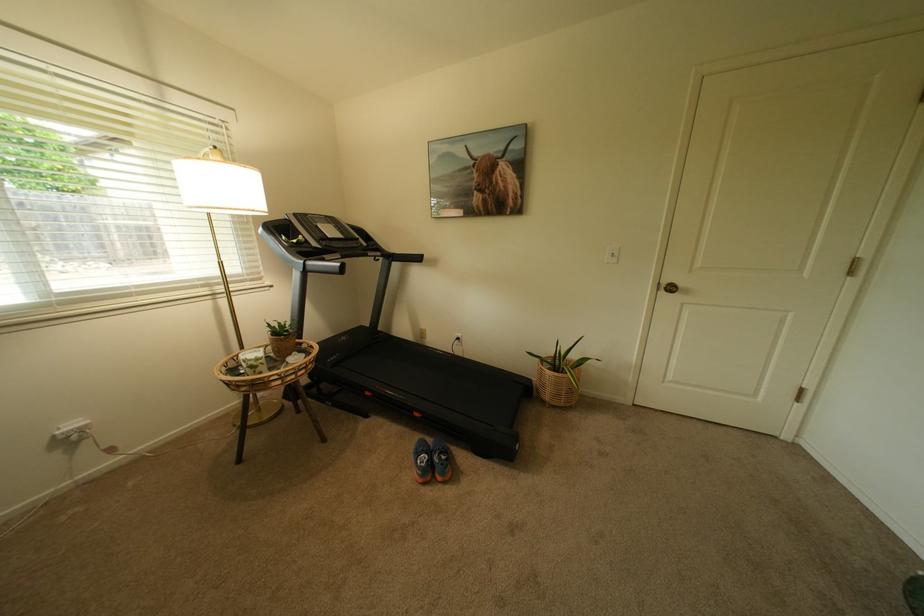
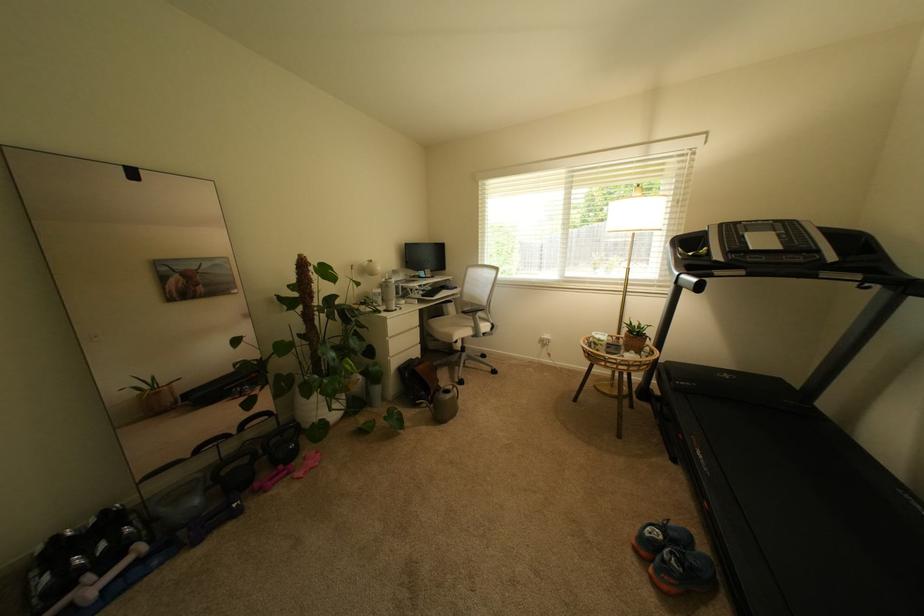
Find the pixel in the second image that matches (x=317, y=270) in the first image.

(688, 283)